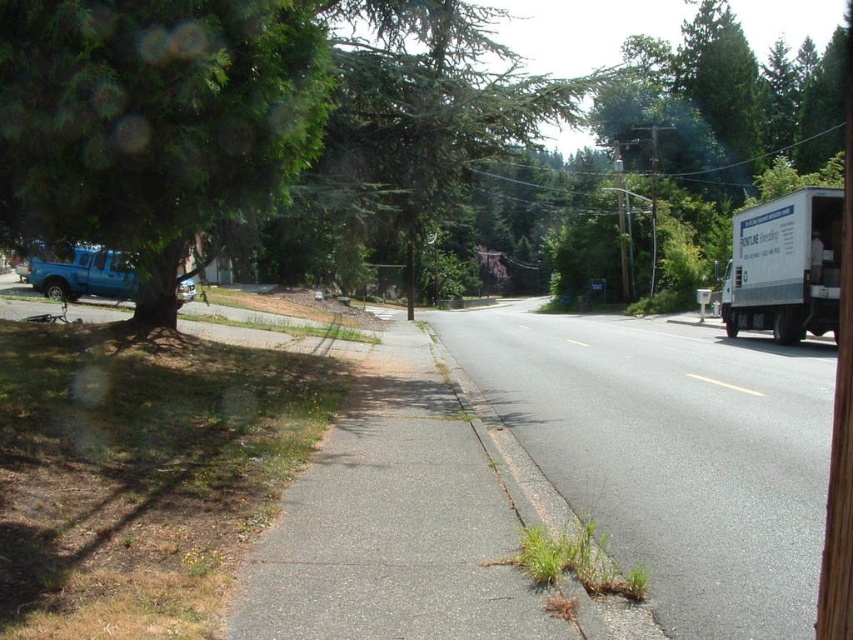
You are a pedestrian standing on the sidewalk between the white matte truck at right and the matte blue truck at left. You need to walk to the nearest truck. Which truck should you walk towards?

The white matte truck at right is 58.61 feet away from the matte blue truck at left. Since you are standing between them, the nearest truck would depend on your exact position. However, without knowing your exact location, it is impossible to determine which truck is closer.

You are a delivery person trying to park your van on the gray asphalt road at center. However, there is a green leafy tree at left above the road. Do you think the van can park there without hitting the tree branches?

The gray asphalt road at center is below the green leafy tree at left, so the tree branches are above the road. The van may hit the branches if parked there.